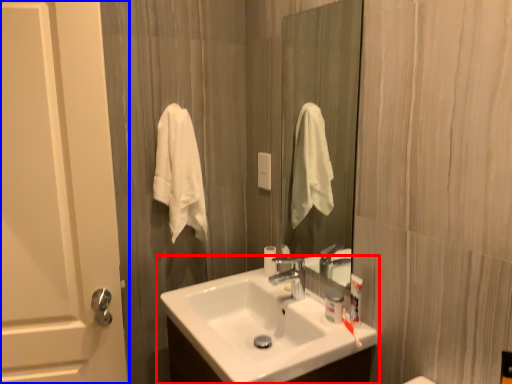
Question: Among these objects, which one is farthest to the camera, sink (highlighted by a red box) or door (highlighted by a blue box)?

Choices:
 (A) sink
 (B) door

Answer: (B)